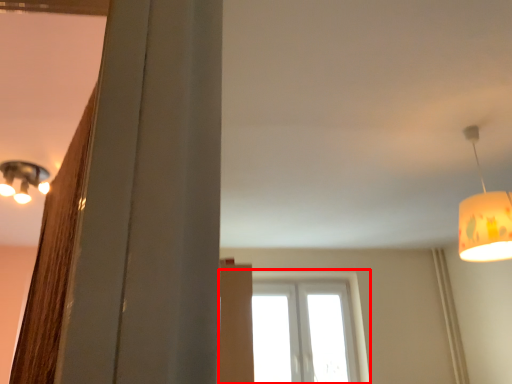
Question: In this image, where is window (annotated by the red box) located relative to lamp?

Choices:
 (A) left
 (B) right

Answer: (A)